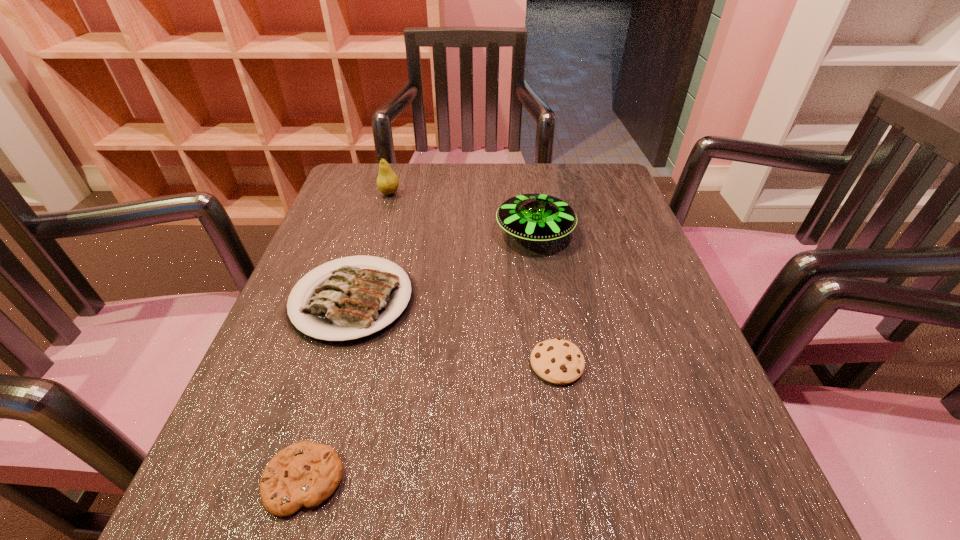
Locate an element on the screen. Image resolution: width=960 pixels, height=540 pixels. vacant space situated 0.150m on the back of the right cookie is located at coordinates (544, 284).

You are a GUI agent. You are given a task and a screenshot of the screen. Output one action in this format:
    pyautogui.click(x=<x>, y=<y>)
    Task: Click on the vacant space located on the right of the left cookie
    The image size is (960, 540).
    Given the screenshot: What is the action you would take?
    pyautogui.click(x=448, y=480)

Where is `pear located at the far edge`? The height and width of the screenshot is (540, 960). pear located at the far edge is located at coordinates (387, 182).

Identify the location of saucer positioned at the far edge. The image size is (960, 540). (534, 217).

What are the coordinates of `object that is at the near edge` in the screenshot? It's located at (306, 473).

You are a GUI agent. You are given a task and a screenshot of the screen. Output one action in this format:
    pyautogui.click(x=<x>, y=<y>)
    Task: Click on the pear at the left edge
    The height and width of the screenshot is (540, 960).
    Given the screenshot: What is the action you would take?
    pyautogui.click(x=387, y=182)

You are a GUI agent. You are given a task and a screenshot of the screen. Output one action in this format:
    pyautogui.click(x=<x>, y=<y>)
    Task: Click on the plate at the left edge
    This screenshot has height=540, width=960.
    Given the screenshot: What is the action you would take?
    pyautogui.click(x=353, y=302)

The image size is (960, 540). Identify the location of cookie that is at the left edge. (306, 473).

Find the location of a particular element. Image resolution: width=960 pixels, height=540 pixels. object present at the right edge is located at coordinates point(534,217).

Identify the location of object that is at the far left corner. The height and width of the screenshot is (540, 960). (387, 182).